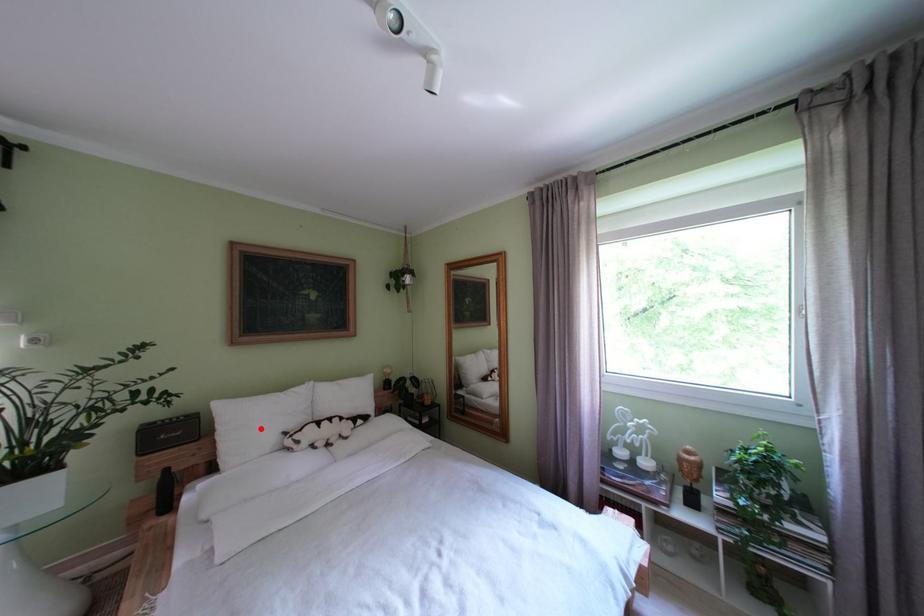
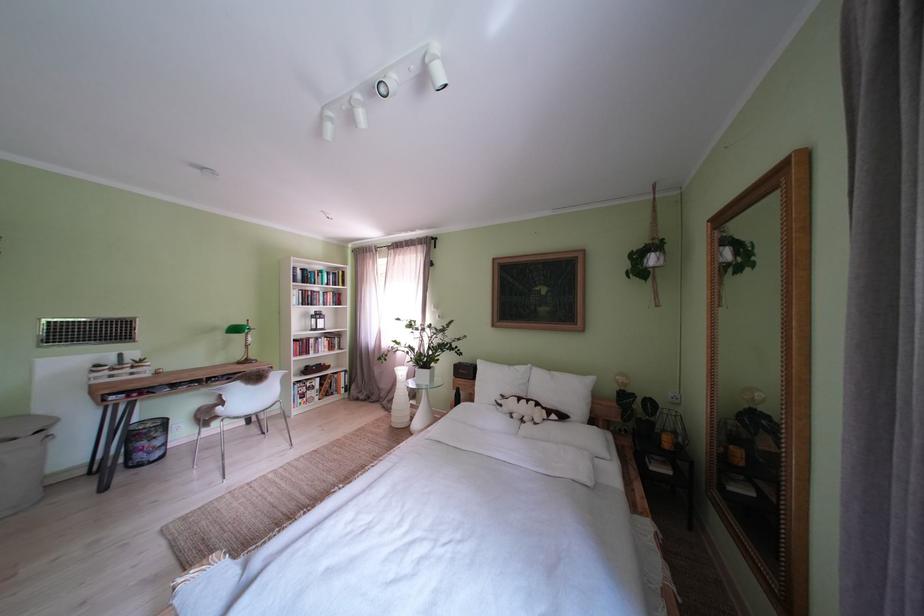
Question: I am providing you with two images of the same scene from different viewpoints. A red point is shown in image1. For the corresponding object point in image2, is it positioned nearer or farther from the camera?

Choices:
 (A) Nearer
 (B) Farther

Answer: (B)